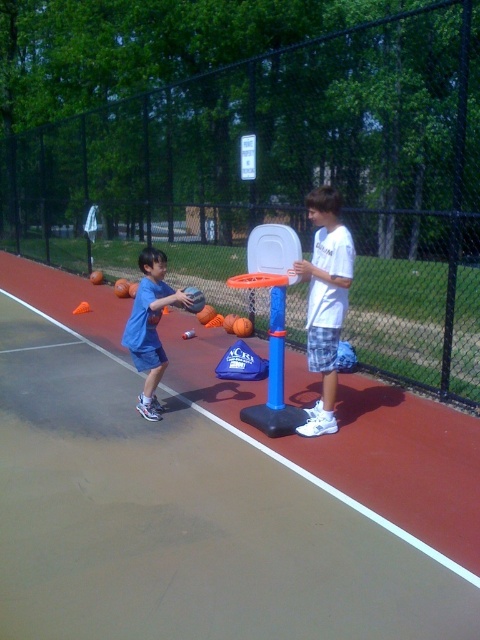
You are standing at the center of the basketball court and want to pass the ball to the white cotton shirt at center. Since the court is 15 meters long, can you throw the ball directly to them without it bouncing?

The white cotton shirt at center is at point (325, 301), which is near the center of the court. Since you are also at the center, the distance is negligible, so you can easily pass the ball directly without needing it to bounce.

You are standing on the basketball court and want to place a small cone at each of the two points labeled point [350,276] and point [144,369]. Which point will have its cone closer to you after placing them?

Point [350,276] is closer to the viewer than point [144,369], so the cone placed at point [350,276] will be closer to you.